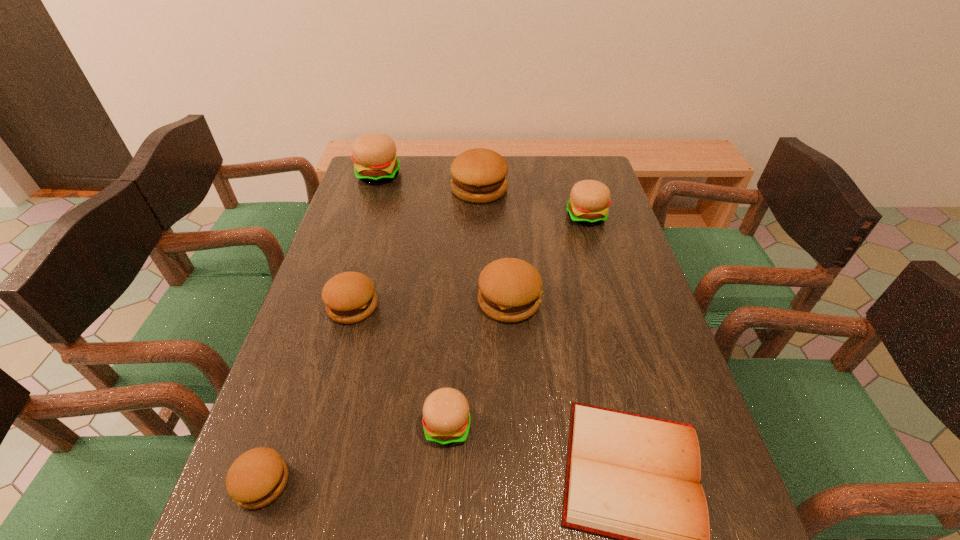
Find the location of `empty space between the nearest brown hamburger and the smallest beige hamburger`. empty space between the nearest brown hamburger and the smallest beige hamburger is located at coordinates (355, 454).

You are a GUI agent. You are given a task and a screenshot of the screen. Output one action in this format:
    pyautogui.click(x=<x>, y=<y>)
    Task: Click on the vacant region between the second smallest brown hamburger and the smallest brown hamburger
    
    Given the screenshot: What is the action you would take?
    pyautogui.click(x=307, y=395)

The height and width of the screenshot is (540, 960). I want to click on empty location between the biggest brown hamburger and the third biggest brown hamburger, so click(x=416, y=248).

Identify the location of object that is the second closest one to the third smallest brown hamburger. (635, 478).

Find the location of a particular element. This screenshot has width=960, height=540. the fourth closest object relative to the leftmost beige hamburger is located at coordinates (589, 199).

Find the location of `hamburger object that ranks as the second closest to the farthest brown hamburger`. hamburger object that ranks as the second closest to the farthest brown hamburger is located at coordinates (374, 154).

The height and width of the screenshot is (540, 960). Find the location of `hamburger that is the second closest one to the smallest brown hamburger`. hamburger that is the second closest one to the smallest brown hamburger is located at coordinates (349, 297).

Select which beige hamburger is the second closest to the Bible. Please provide its 2D coordinates. Your answer should be formatted as a tuple, i.e. [(x, y)], where the tuple contains the x and y coordinates of a point satisfying the conditions above.

[(589, 199)]

The image size is (960, 540). What are the coordinates of `beige hamburger that is the third closest to the shortest object` in the screenshot? It's located at (374, 154).

Identify the location of the closest brown hamburger to the third smallest brown hamburger. (349, 297).